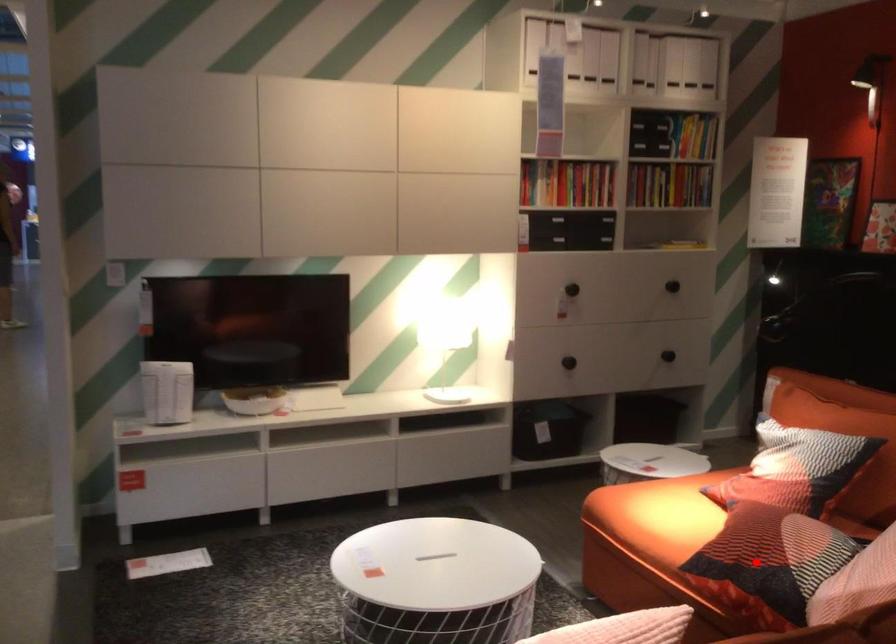
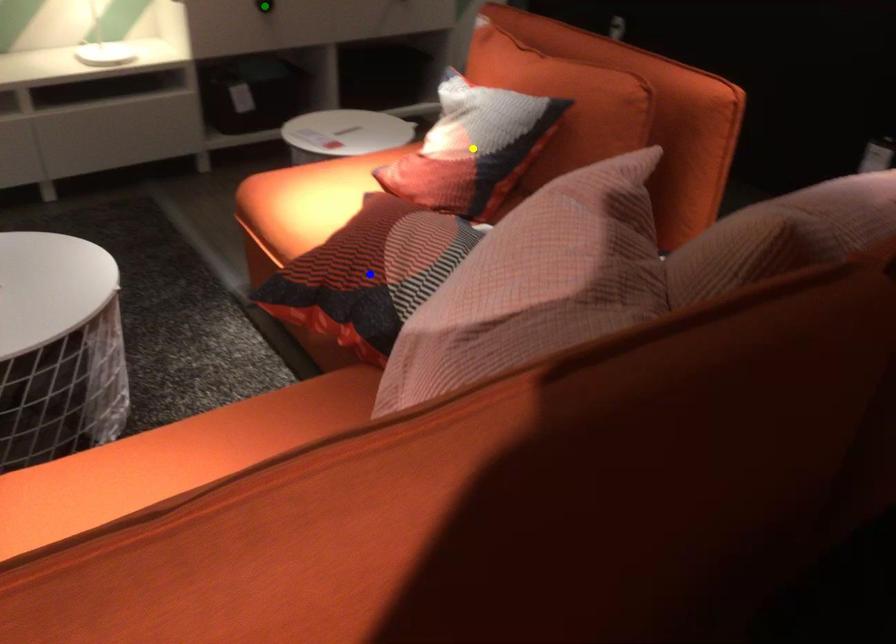
Question: I am providing you with two images of the same scene from different viewpoints. A red point is marked on the first image. You are given multiple points on the second image. Can you choose the point in image 2 that corresponds to the point in image 1?

Choices:
 (A) green point
 (B) yellow point
 (C) blue point

Answer: (C)